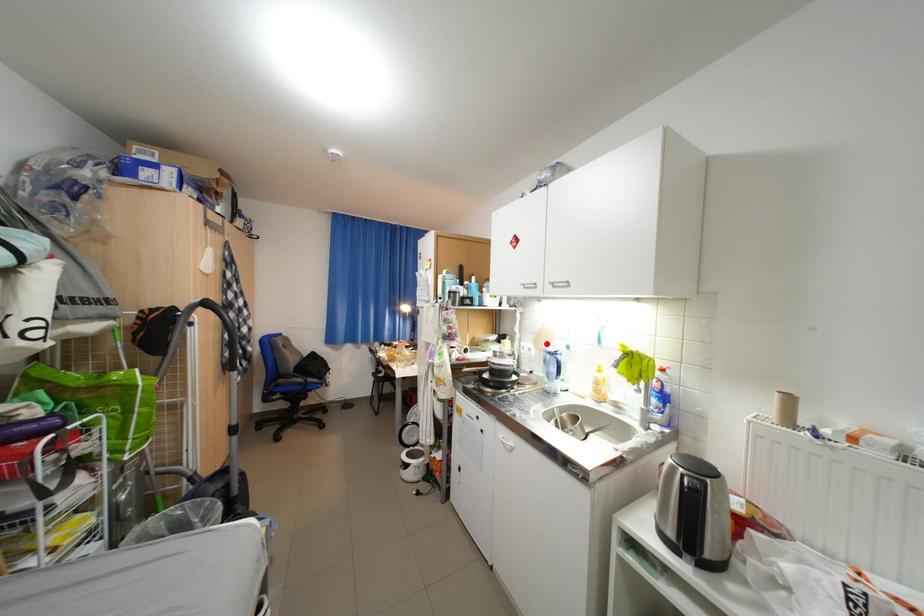
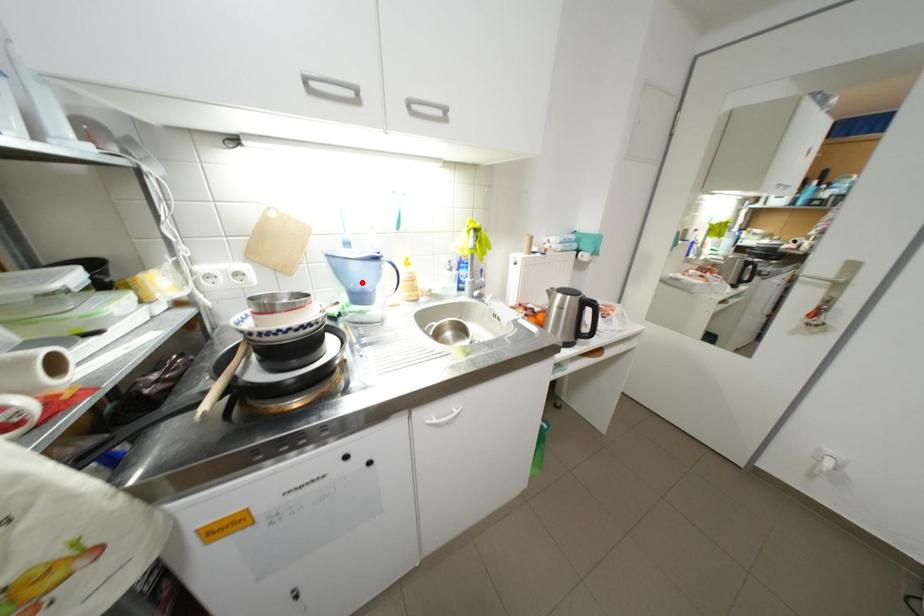
I am providing you with two images of the same scene from different viewpoints. A red point is marked on the first image and another point is marked on the second image. Are the points marked in image1 and image2 representing the same 3D position?

No